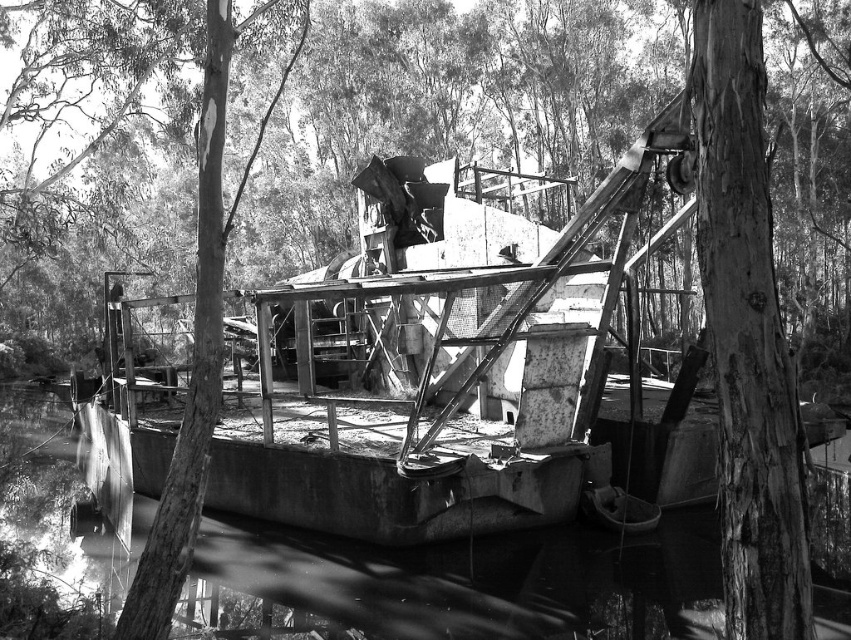
Question: Which point is farther to the camera?

Choices:
 (A) (413, 593)
 (B) (827, 32)

Answer: (B)

Question: Is rough bark tree at center bigger than smooth concrete river at center?

Choices:
 (A) no
 (B) yes

Answer: (B)

Question: Considering the relative positions of rough bark tree at center and smooth concrete river at center in the image provided, where is rough bark tree at center located with respect to smooth concrete river at center?

Choices:
 (A) left
 (B) right

Answer: (A)

Question: Which of the following is the farthest from the observer?

Choices:
 (A) [260, 173]
 (B) [569, 593]

Answer: (A)

Question: Which point is farther to the camera?

Choices:
 (A) (380, 573)
 (B) (312, 52)

Answer: (B)

Question: In this image, where is rough bark tree at center located relative to smooth concrete river at center?

Choices:
 (A) below
 (B) above

Answer: (B)